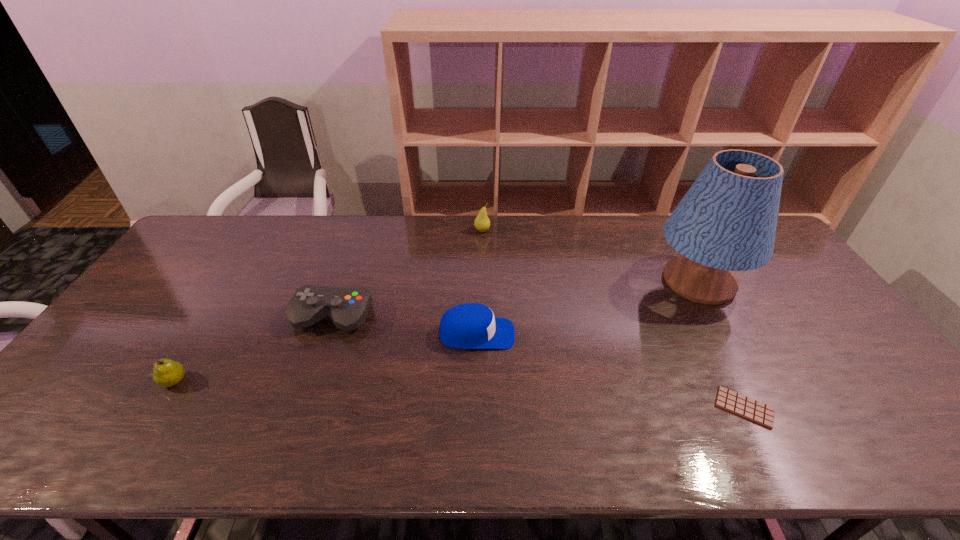
Locate an element on the screen. This screenshot has height=540, width=960. free space located 0.170m on the left of the nearer pear is located at coordinates (93, 381).

The height and width of the screenshot is (540, 960). What are the coordinates of `vacant space located on the right of the control` in the screenshot? It's located at [448, 318].

This screenshot has width=960, height=540. Find the location of `free point located on the front-facing side of the baseball cap`. free point located on the front-facing side of the baseball cap is located at coordinates (605, 334).

The image size is (960, 540). In order to click on vacant space located on the back of the candy bar in this screenshot , I will do `click(686, 295)`.

Locate an element on the screen. The height and width of the screenshot is (540, 960). lampshade located in the far edge section of the desktop is located at coordinates (727, 220).

The height and width of the screenshot is (540, 960). What are the coordinates of `pear at the far edge` in the screenshot? It's located at (482, 223).

The height and width of the screenshot is (540, 960). What are the coordinates of `object situated at the near edge` in the screenshot? It's located at (728, 400).

Locate an element on the screen. The height and width of the screenshot is (540, 960). free space at the far edge of the desktop is located at coordinates (331, 233).

Locate an element on the screen. Image resolution: width=960 pixels, height=540 pixels. vacant space at the near edge of the desktop is located at coordinates (574, 448).

Image resolution: width=960 pixels, height=540 pixels. In order to click on free space at the left edge of the desktop in this screenshot , I will do `click(142, 354)`.